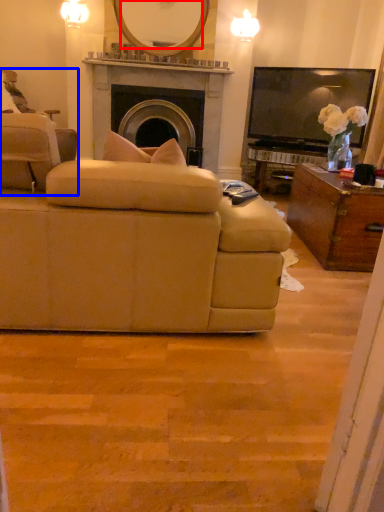
Question: Which of the following is the farthest to the observer, mirror (highlighted by a red box) or chair (highlighted by a blue box)?

Choices:
 (A) mirror
 (B) chair

Answer: (A)